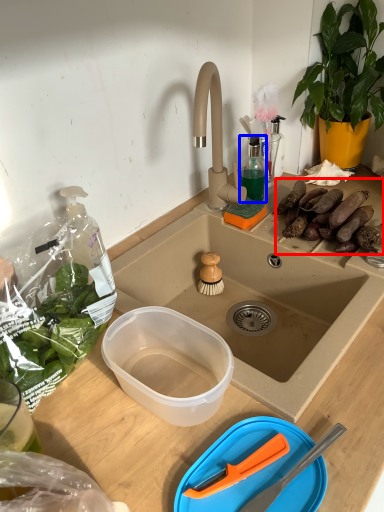
Question: Among these objects, which one is nearest to the camera, food (highlighted by a red box) or bottle (highlighted by a blue box)?

Choices:
 (A) food
 (B) bottle

Answer: (A)